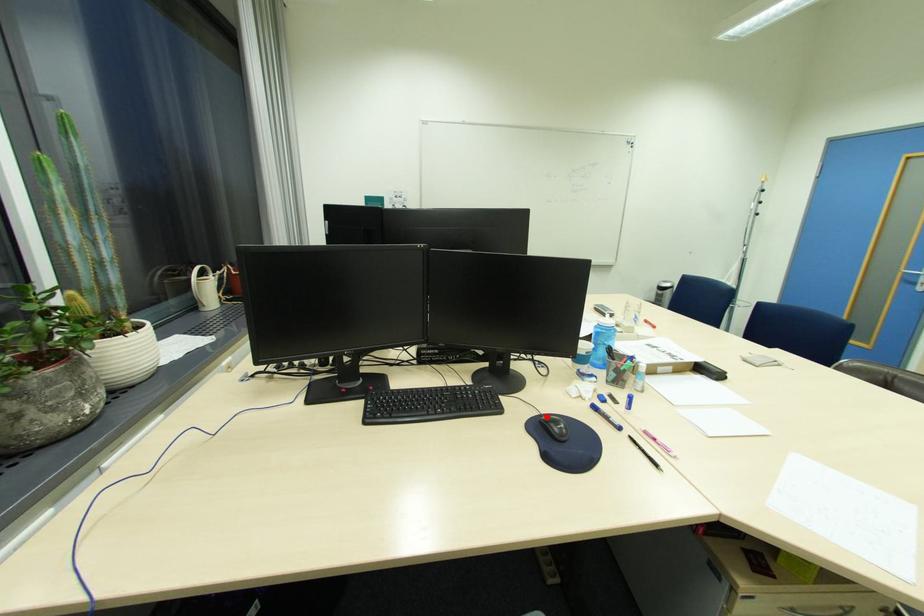
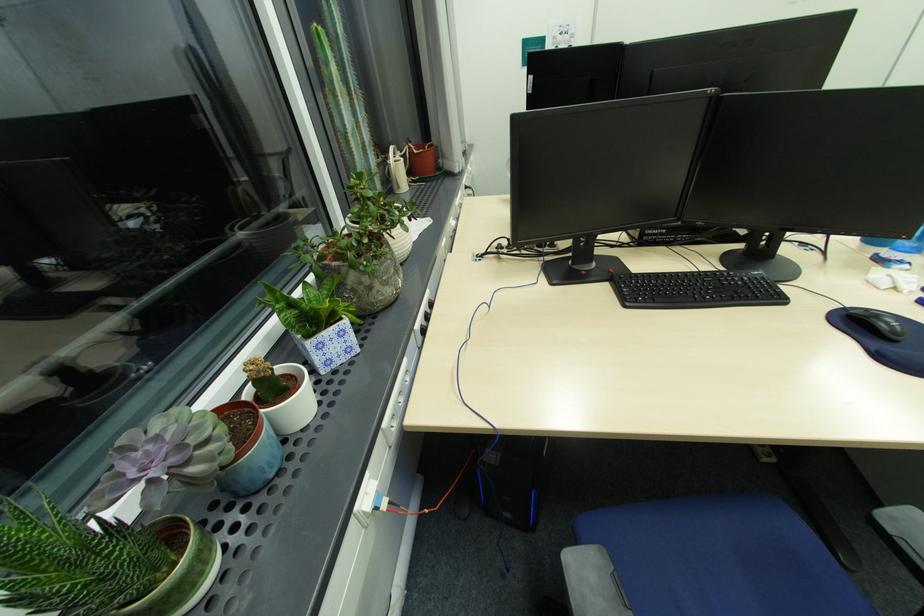
The point at the highlighted location is marked in the first image. Where is the corresponding point in the second image?

(849, 310)